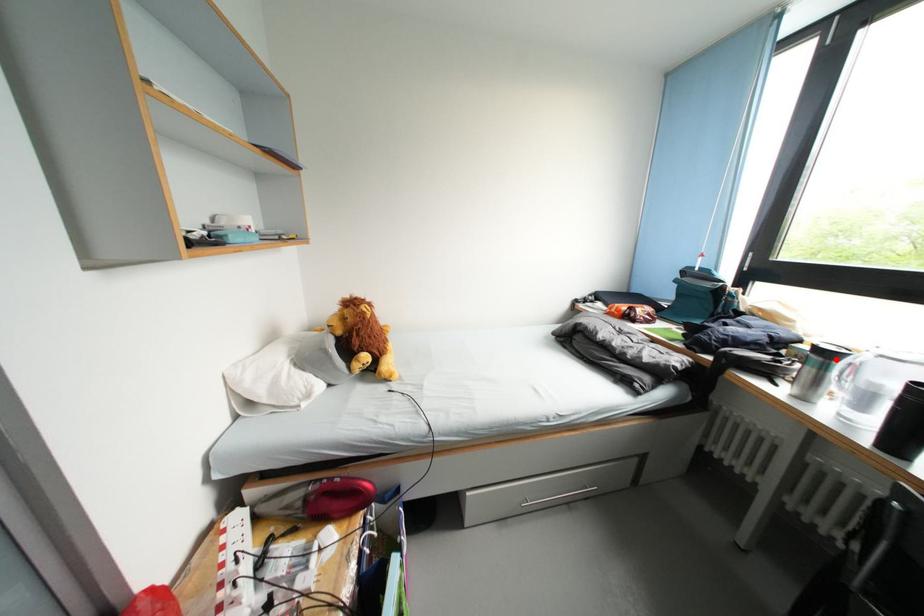
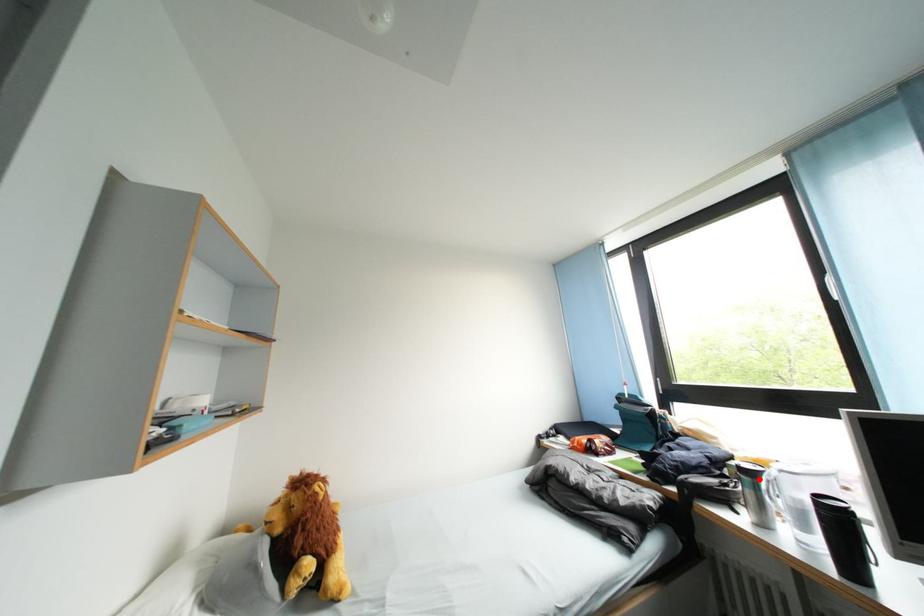
I am providing you with two images of the same scene from different viewpoints. A red point is marked on the first image and another point is marked on the second image. Is the marked point in image1 the same physical position as the marked point in image2?

Yes